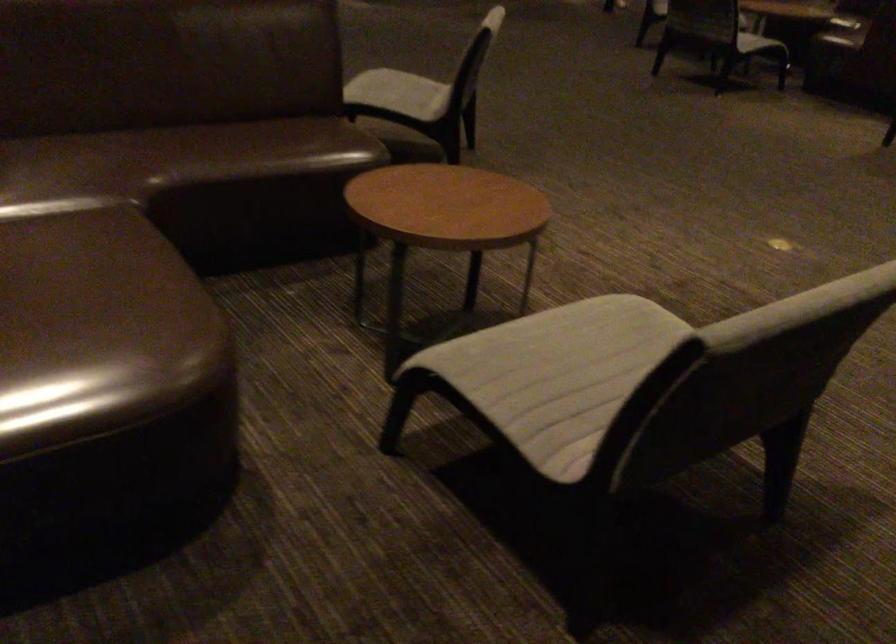
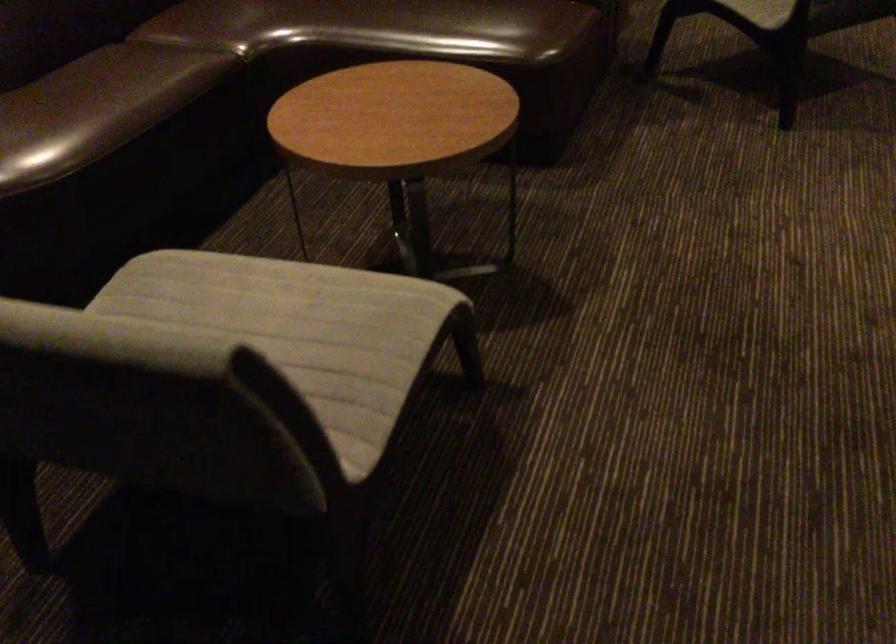
In the second image, find the point that corresponds to (304,149) in the first image.

(444, 26)